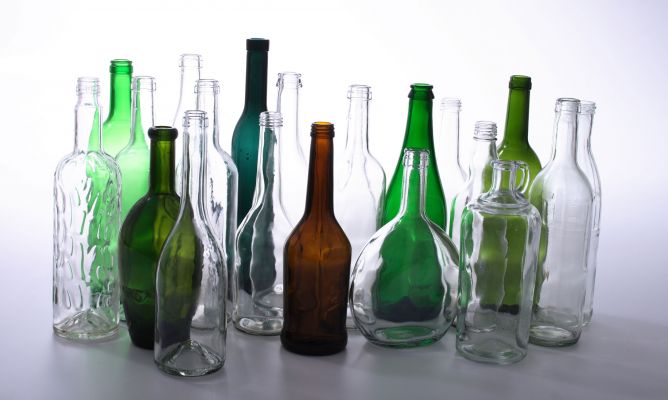
Locate an element on the screen. Image resolution: width=668 pixels, height=400 pixels. bottles to the left of the brown bottle is located at coordinates 287,168, 265,217, 244,152, 216,172, 188,168, 182,104, 156,163, 146,114, 119,112, 84,166.